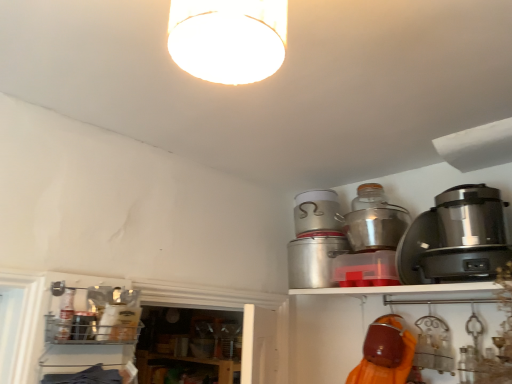
Find the location of a particular element. The width and height of the screenshot is (512, 384). brushed metal canister at lower left, placed as the 1th appliance when sorted from left to right is located at coordinates (83, 325).

You are a GUI agent. You are given a task and a screenshot of the screen. Output one action in this format:
    pyautogui.click(x=<x>, y=<y>)
    Task: Click on the metallic silver pot at upper right, which is the 4th appliance in left-to-right order
    Image resolution: width=512 pixels, height=384 pixels.
    Given the screenshot: What is the action you would take?
    pyautogui.click(x=374, y=220)

How distant is brushed metal canister at lower left, placed as the 1th appliance when sorted from left to right, from metallic silver pot at upper center, which is the third appliance from left to right?

A distance of 3.62 feet exists between brushed metal canister at lower left, placed as the 1th appliance when sorted from left to right, and metallic silver pot at upper center, which is the third appliance from left to right.

Which of these two, brushed metal canister at lower left, the fourth appliance viewed from the right, or metallic silver pot at upper center, which is the third appliance from left to right, is smaller?

brushed metal canister at lower left, the fourth appliance viewed from the right, is smaller.

From the picture: From a real-world perspective, is brushed metal canister at lower left, placed as the 1th appliance when sorted from left to right, physically above metallic silver pot at upper center, the 2th appliance positioned from the right?

Actually, brushed metal canister at lower left, placed as the 1th appliance when sorted from left to right, is physically below metallic silver pot at upper center, the 2th appliance positioned from the right, in the real world.

Is brushed metal canister at lower left, placed as the 1th appliance when sorted from left to right, not within metallic silver pot at upper center, the 2th appliance positioned from the right?

That's correct, brushed metal canister at lower left, placed as the 1th appliance when sorted from left to right, is outside of metallic silver pot at upper center, the 2th appliance positioned from the right.

Does point (372, 229) lie in front of point (315, 228)?

Yes.

From a real-world perspective, does metallic silver pot at upper right, placed as the 1th appliance when sorted from right to left, stand above metallic silver pot at upper center, which is the third appliance from left to right?

No.

Which of these two, metallic silver pot at upper right, which is the 4th appliance in left-to-right order, or metallic silver pot at upper center, which is the third appliance from left to right, stands taller?

With more height is metallic silver pot at upper right, which is the 4th appliance in left-to-right order.

Does metallic silver pot at upper right, which is the 4th appliance in left-to-right order, contain metallic silver pot at upper center, the 2th appliance positioned from the right?

No, metallic silver pot at upper center, the 2th appliance positioned from the right, is not inside metallic silver pot at upper right, which is the 4th appliance in left-to-right order.

From the image's perspective, is metallic silver canister at upper right, the second appliance from the left, on metallic silver pot at upper center, the 2th appliance positioned from the right?

No, from the image's perspective, metallic silver canister at upper right, the second appliance from the left, is not on top of metallic silver pot at upper center, the 2th appliance positioned from the right.

Is metallic silver canister at upper right, positioned as the third appliance in right-to-left order, facing towards metallic silver pot at upper center, which is the third appliance from left to right?

No.

How different are the orientations of metallic silver canister at upper right, the second appliance from the left, and metallic silver pot at upper center, which is the third appliance from left to right, in degrees?

The angle between the facing direction of metallic silver canister at upper right, the second appliance from the left, and the facing direction of metallic silver pot at upper center, which is the third appliance from left to right, is 0.000659 degrees.

From a real-world perspective, which object stands above the other?

From a 3D spatial view, metallic silver pot at upper center, the 2th appliance positioned from the right, is above.

Is brushed metal canister at lower left, placed as the 1th appliance when sorted from left to right, not inside metallic silver pot at upper right, placed as the 1th appliance when sorted from right to left?

Yes, brushed metal canister at lower left, placed as the 1th appliance when sorted from left to right, is outside of metallic silver pot at upper right, placed as the 1th appliance when sorted from right to left.

Considering the relative positions of brushed metal canister at lower left, placed as the 1th appliance when sorted from left to right, and metallic silver pot at upper right, which is the 4th appliance in left-to-right order, in the image provided, is brushed metal canister at lower left, placed as the 1th appliance when sorted from left to right, to the left or to the right of metallic silver pot at upper right, which is the 4th appliance in left-to-right order,?

From the image, it's evident that brushed metal canister at lower left, placed as the 1th appliance when sorted from left to right, is to the left of metallic silver pot at upper right, which is the 4th appliance in left-to-right order.

Could you measure the distance between brushed metal canister at lower left, the fourth appliance viewed from the right, and metallic silver pot at upper right, which is the 4th appliance in left-to-right order?

They are 3.97 feet apart.

Does brushed metal canister at lower left, placed as the 1th appliance when sorted from left to right, have a larger size compared to metallic silver pot at upper right, placed as the 1th appliance when sorted from right to left?

No, brushed metal canister at lower left, placed as the 1th appliance when sorted from left to right, is not bigger than metallic silver pot at upper right, placed as the 1th appliance when sorted from right to left.

Is metallic silver canister at upper right, positioned as the third appliance in right-to-left order, a part of brushed metal canister at lower left, the fourth appliance viewed from the right?

No, metallic silver canister at upper right, positioned as the third appliance in right-to-left order, is not inside brushed metal canister at lower left, the fourth appliance viewed from the right.

Which of these two, brushed metal canister at lower left, the fourth appliance viewed from the right, or metallic silver canister at upper right, the second appliance from the left, is bigger?

metallic silver canister at upper right, the second appliance from the left, is bigger.

In the scene shown: Can you confirm if brushed metal canister at lower left, placed as the 1th appliance when sorted from left to right, is positioned to the left of metallic silver canister at upper right, the second appliance from the left?

Yes, brushed metal canister at lower left, placed as the 1th appliance when sorted from left to right, is to the left of metallic silver canister at upper right, the second appliance from the left.

Considering the sizes of objects brushed metal canister at lower left, placed as the 1th appliance when sorted from left to right, and metallic silver canister at upper right, positioned as the third appliance in right-to-left order, in the image provided, who is taller, brushed metal canister at lower left, placed as the 1th appliance when sorted from left to right, or metallic silver canister at upper right, positioned as the third appliance in right-to-left order,?

With more height is metallic silver canister at upper right, positioned as the third appliance in right-to-left order.

Which is behind, point (298, 212) or point (74, 320)?

The point (298, 212) is more distant.

In the scene shown: Between metallic silver pot at upper center, the 2th appliance positioned from the right, and brushed metal canister at lower left, placed as the 1th appliance when sorted from left to right, which one has less height?

brushed metal canister at lower left, placed as the 1th appliance when sorted from left to right, is shorter.

I want to click on appliance that is the 3rd object located below the metallic silver pot at upper center, which is the third appliance from left to right (from the image's perspective), so click(x=83, y=325).

Is brushed metal canister at lower left, the fourth appliance viewed from the right, at the back of metallic silver pot at upper center, which is the third appliance from left to right?

No, brushed metal canister at lower left, the fourth appliance viewed from the right, is not at the back of metallic silver pot at upper center, which is the third appliance from left to right.

Image resolution: width=512 pixels, height=384 pixels. I want to click on appliance above the metallic silver pot at upper right, which is the 4th appliance in left-to-right order (from a real-world perspective), so click(x=317, y=212).

Which is behind, point (306, 210) or point (397, 210)?

Positioned behind is point (306, 210).

What's the angular difference between metallic silver pot at upper center, which is the third appliance from left to right, and metallic silver pot at upper right, placed as the 1th appliance when sorted from right to left,'s facing directions?

The facing directions of metallic silver pot at upper center, which is the third appliance from left to right, and metallic silver pot at upper right, placed as the 1th appliance when sorted from right to left, are 0.000686 degrees apart.

Visually, is metallic silver pot at upper center, which is the third appliance from left to right, positioned to the left or to the right of metallic silver pot at upper right, which is the 4th appliance in left-to-right order?

In the image, metallic silver pot at upper center, which is the third appliance from left to right, appears on the left side of metallic silver pot at upper right, which is the 4th appliance in left-to-right order.

Locate an element on the screen. This screenshot has height=384, width=512. the 3rd appliance in front of the metallic silver pot at upper center, which is the third appliance from left to right is located at coordinates (83, 325).

The width and height of the screenshot is (512, 384). Find the location of `the 1st appliance to the left when counting from the metallic silver pot at upper right, placed as the 1th appliance when sorted from right to left`. the 1st appliance to the left when counting from the metallic silver pot at upper right, placed as the 1th appliance when sorted from right to left is located at coordinates (317, 212).

Based on their spatial positions, is metallic silver pot at upper right, which is the 4th appliance in left-to-right order, or brushed metal canister at lower left, placed as the 1th appliance when sorted from left to right, further from metallic silver pot at upper center, the 2th appliance positioned from the right?

brushed metal canister at lower left, placed as the 1th appliance when sorted from left to right, is further to metallic silver pot at upper center, the 2th appliance positioned from the right.

Considering their positions, is metallic silver canister at upper right, positioned as the third appliance in right-to-left order, positioned further to brushed metal canister at lower left, placed as the 1th appliance when sorted from left to right, than metallic silver pot at upper right, placed as the 1th appliance when sorted from right to left?

metallic silver pot at upper right, placed as the 1th appliance when sorted from right to left, is positioned further to the anchor brushed metal canister at lower left, placed as the 1th appliance when sorted from left to right.

From the image, which object appears to be nearer to metallic silver pot at upper center, which is the third appliance from left to right, brushed metal canister at lower left, placed as the 1th appliance when sorted from left to right, or metallic silver pot at upper right, which is the 4th appliance in left-to-right order?

metallic silver pot at upper right, which is the 4th appliance in left-to-right order, lies closer to metallic silver pot at upper center, which is the third appliance from left to right, than the other object.

Considering their positions, is brushed metal canister at lower left, the fourth appliance viewed from the right, positioned further to metallic silver canister at upper right, positioned as the third appliance in right-to-left order, than metallic silver pot at upper center, which is the third appliance from left to right?

brushed metal canister at lower left, the fourth appliance viewed from the right, lies further to metallic silver canister at upper right, positioned as the third appliance in right-to-left order, than the other object.

Considering their positions, is metallic silver pot at upper center, the 2th appliance positioned from the right, positioned further to metallic silver pot at upper right, which is the 4th appliance in left-to-right order, than metallic silver canister at upper right, positioned as the third appliance in right-to-left order?

The object further to metallic silver pot at upper right, which is the 4th appliance in left-to-right order, is metallic silver canister at upper right, positioned as the third appliance in right-to-left order.

Estimate the real-world distances between objects in this image. Which object is further from brushed metal canister at lower left, placed as the 1th appliance when sorted from left to right, metallic silver pot at upper center, which is the third appliance from left to right, or metallic silver pot at upper right, which is the 4th appliance in left-to-right order?

metallic silver pot at upper right, which is the 4th appliance in left-to-right order, is positioned further to the anchor brushed metal canister at lower left, placed as the 1th appliance when sorted from left to right.

Based on their spatial positions, is metallic silver pot at upper center, which is the third appliance from left to right, or metallic silver pot at upper right, placed as the 1th appliance when sorted from right to left, closer to metallic silver canister at upper right, the second appliance from the left?

metallic silver pot at upper center, which is the third appliance from left to right, is closer to metallic silver canister at upper right, the second appliance from the left.

When comparing their distances from metallic silver pot at upper right, placed as the 1th appliance when sorted from right to left, does metallic silver canister at upper right, positioned as the third appliance in right-to-left order, or brushed metal canister at lower left, placed as the 1th appliance when sorted from left to right, seem closer?

Among the two, metallic silver canister at upper right, positioned as the third appliance in right-to-left order, is located nearer to metallic silver pot at upper right, placed as the 1th appliance when sorted from right to left.

What are the coordinates of `appliance between brushed metal canister at lower left, placed as the 1th appliance when sorted from left to right, and metallic silver pot at upper center, the 2th appliance positioned from the right, in the horizontal direction` in the screenshot? It's located at (314, 258).

This screenshot has height=384, width=512. I want to click on appliance between metallic silver canister at upper right, the second appliance from the left, and metallic silver pot at upper right, which is the 4th appliance in left-to-right order, in the horizontal direction, so click(x=317, y=212).